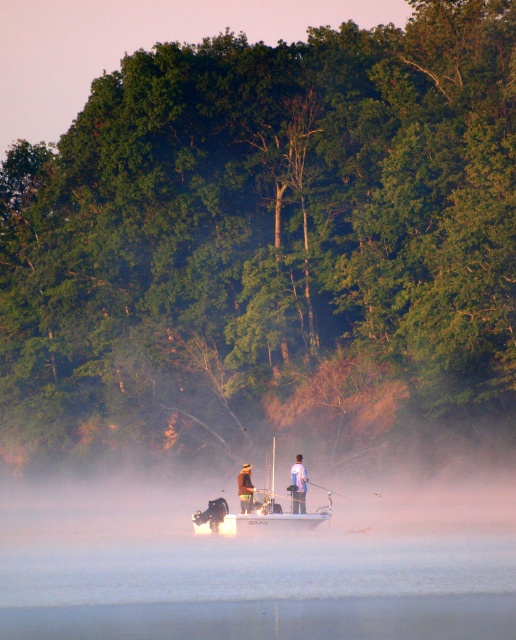
You are a photographer trying to capture a candid shot of the two people on the boat. You want to ensure that both the blue fabric shirt at center and the brown leather jacket at center are clearly visible in the frame. Based on their positions, which clothing item is more likely to be in the foreground of your photo?

The blue fabric shirt at center is wider than the brown leather jacket at center, so it might be positioned closer to the camera, making it more likely to be in the foreground of the photo.

You are a photographer trying to capture the two people on the boat. You notice the blue fabric shirt at center and the brown leather jacket at center. Which person should you focus on first to ensure they are in sharp focus if you want to capture both in the same frame?

The blue fabric shirt at center is further to the viewer than the brown leather jacket at center, so you should focus on the person wearing the blue fabric shirt at center first to ensure both are in focus.